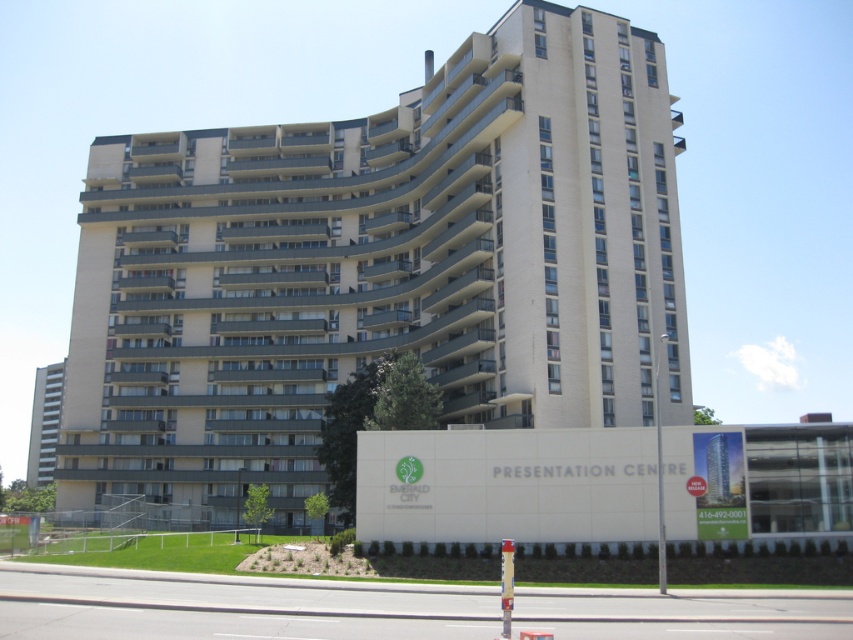
Question: Which point is farther to the camera?

Choices:
 (A) (560, 86)
 (B) (28, 465)

Answer: (B)

Question: Does beige concrete building at center have a larger size compared to beige concrete building at left?

Choices:
 (A) yes
 (B) no

Answer: (A)

Question: Which point is closer to the camera taking this photo?

Choices:
 (A) tap(42, 476)
 (B) tap(187, 179)

Answer: (B)

Question: Is beige concrete building at center bigger than beige concrete building at left?

Choices:
 (A) no
 (B) yes

Answer: (B)

Question: Is beige concrete building at center wider than beige concrete building at left?

Choices:
 (A) no
 (B) yes

Answer: (B)